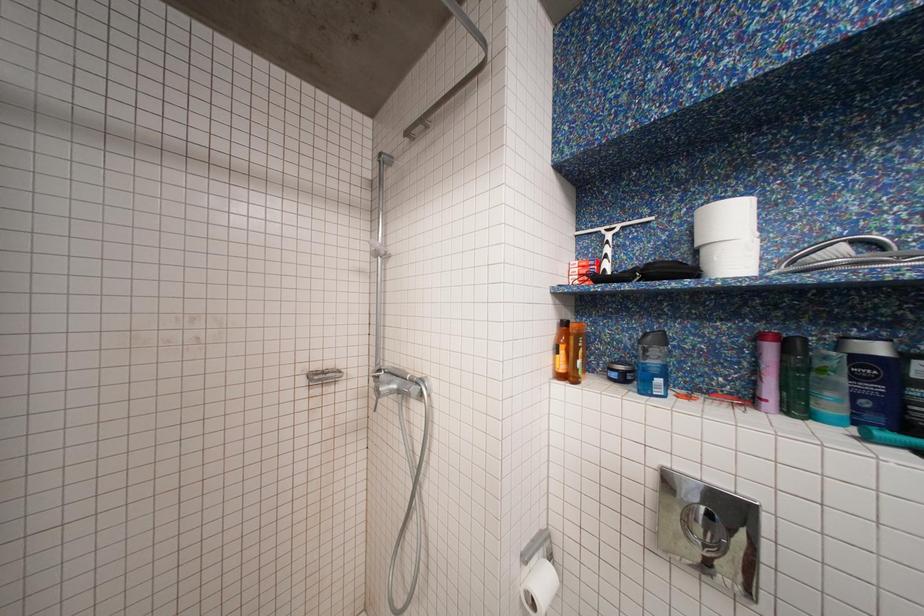
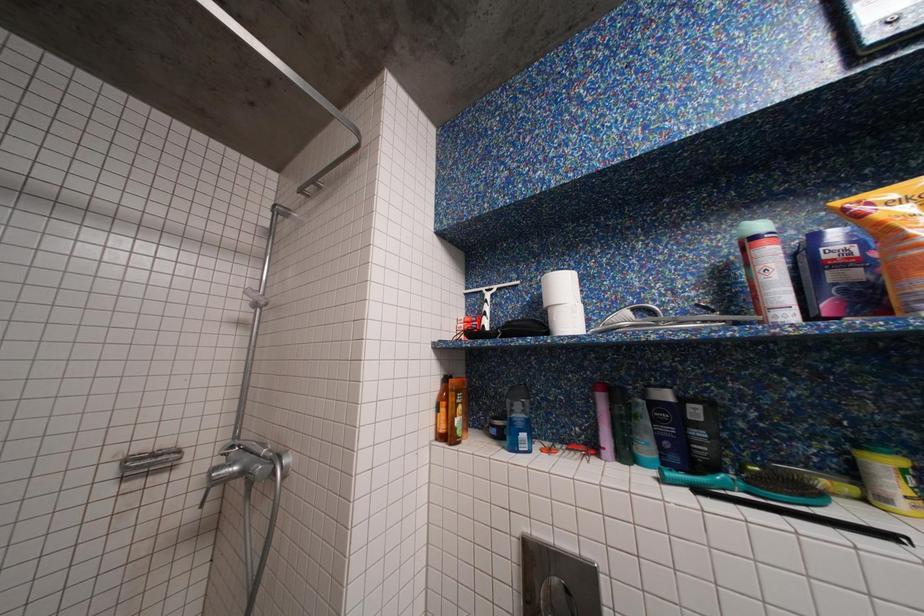
Question: Which direction would the cameraman need to move to produce the second image? Reply with the corresponding letter.

Choices:
 (A) Left
 (B) Right
 (C) Forward
 (D) Backward

Answer: (B)